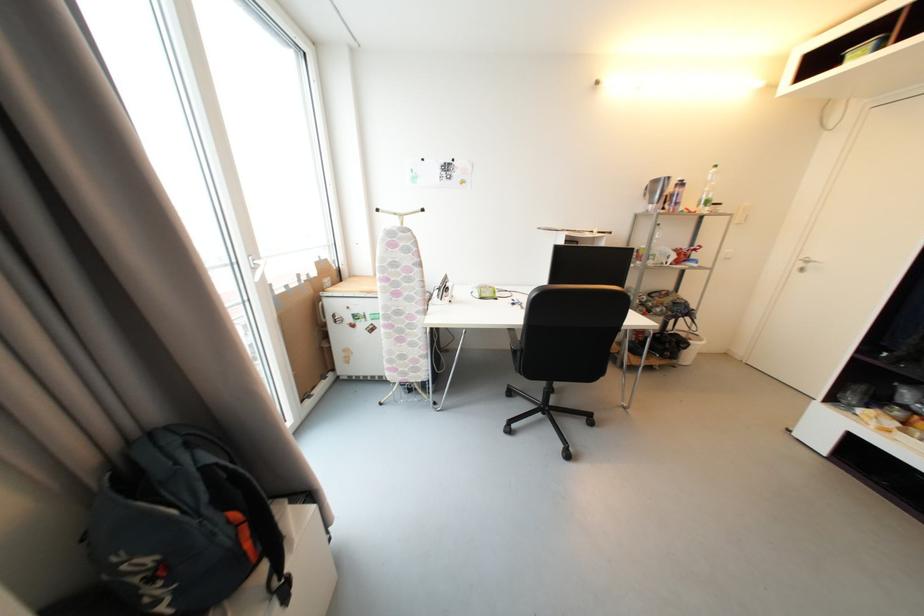
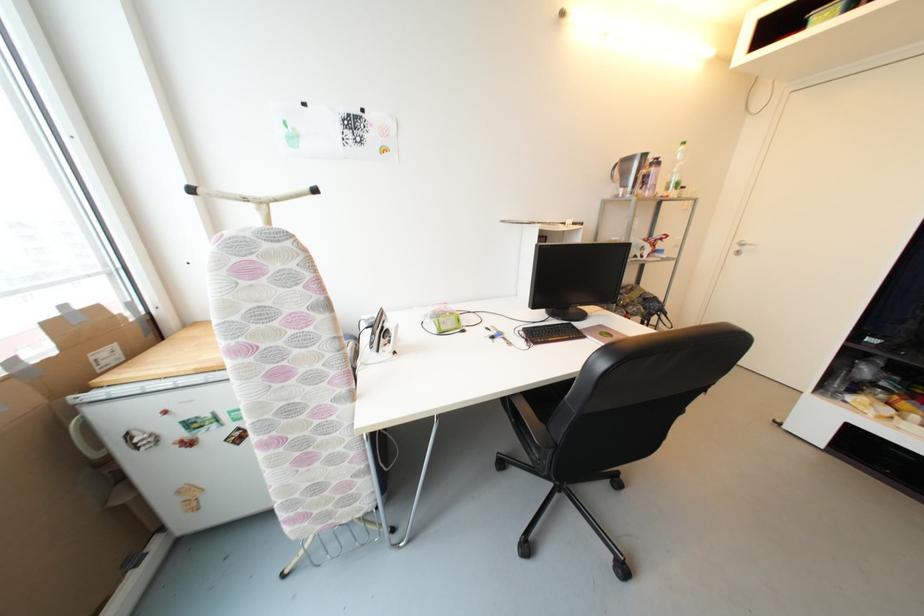
Locate, in the second image, the point that corresponds to the point at 325,302 in the first image.

(81, 416)